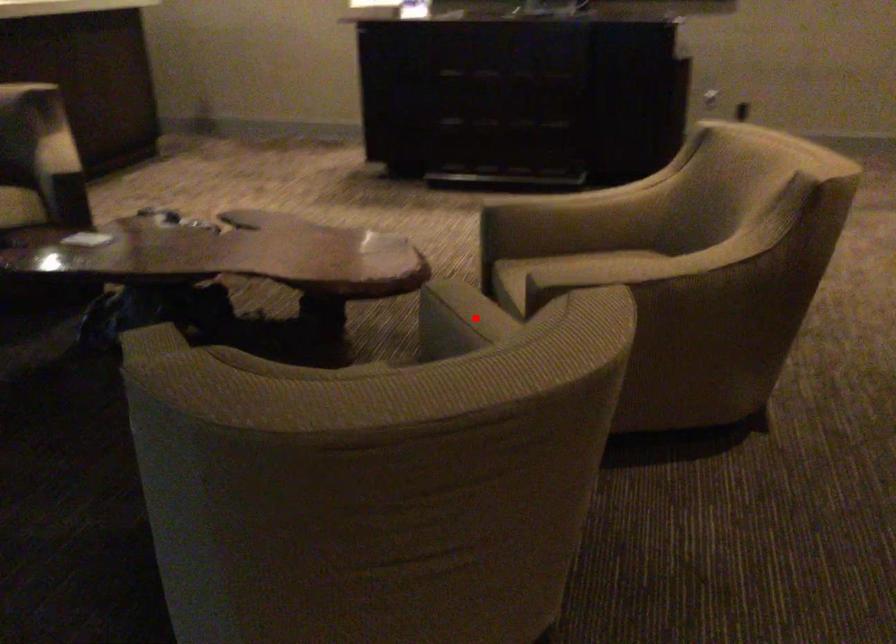
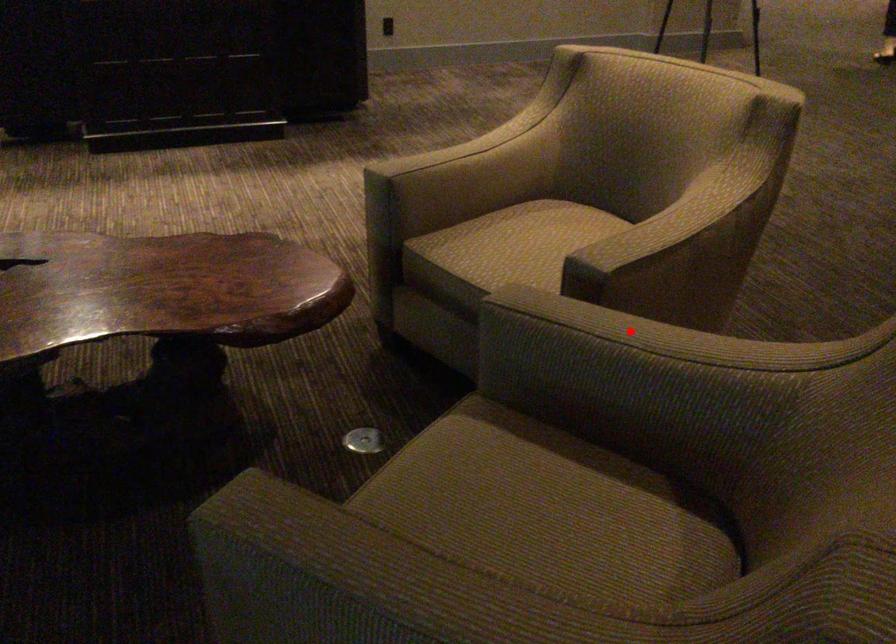
I am providing you with two images of the same scene from different viewpoints. A red point is marked on the first image and another point is marked on the second image. Are the points marked in image1 and image2 representing the same 3D position?

Yes